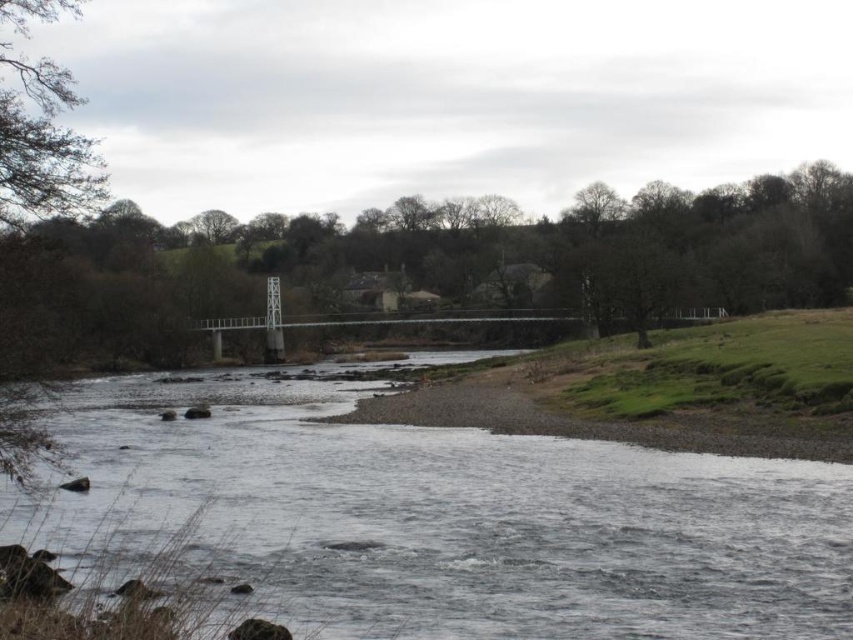
Question: Is gray smooth river at center to the left of brown textured tree at left from the viewer's perspective?

Choices:
 (A) no
 (B) yes

Answer: (A)

Question: Does gray smooth river at center come behind brown textured tree at left?

Choices:
 (A) yes
 (B) no

Answer: (B)

Question: Is gray smooth river at center smaller than brown textured tree at left?

Choices:
 (A) yes
 (B) no

Answer: (A)